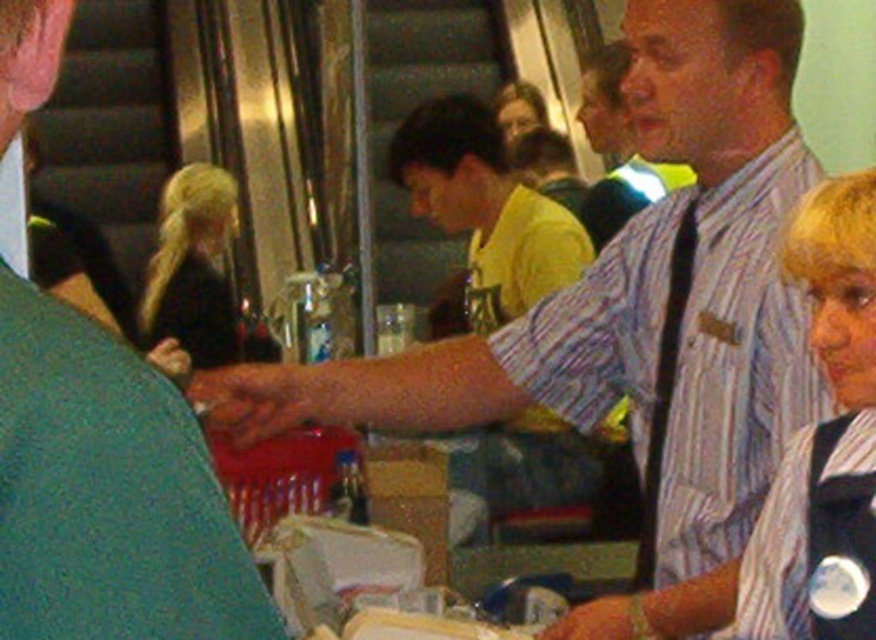
You are organizing a clothing display and need to arrange the matte blue shirt at center and the yellow matte shirt at center side by side. Which shirt should be placed on the left to ensure they fit within a 1.2 meter wide display area?

The matte blue shirt at center has a smaller width than the yellow matte shirt at center. To fit both within the 1.2 meter display area, place the narrower matte blue shirt at center on the left and the wider yellow matte shirt at center on the right.

You are a photographer standing at the back of the room. You want to take a photo of both the matte blue shirt at center and the black fabric vest at right. Can you fit both subjects into your camera frame if your camera has a maximum horizontal field of view of 3 feet?

The distance between the matte blue shirt at center and the black fabric vest at right is 3.44 feet, which exceeds the camera frame of 3 feet. Therefore, both subjects cannot be captured in a single frame.